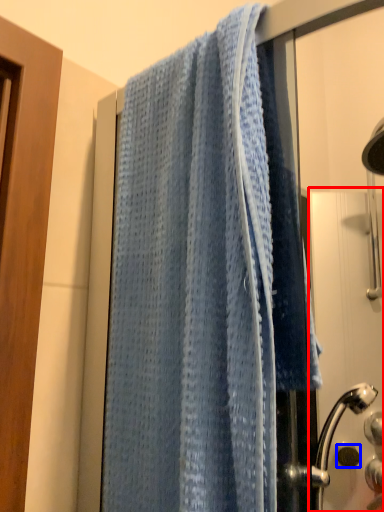
Question: Which object appears farthest to the camera in this image, screen door (highlighted by a red box) or knob (highlighted by a blue box)?

Choices:
 (A) screen door
 (B) knob

Answer: (B)